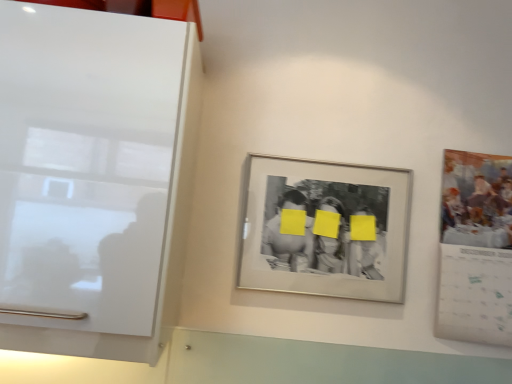
Identify the location of white glossy cabinet at left. (94, 177).

Describe the element at coordinates (94, 177) in the screenshot. The image size is (512, 384). I see `white glossy cabinet at left` at that location.

The height and width of the screenshot is (384, 512). What do you see at coordinates (319, 231) in the screenshot? I see `silver/metallic photo frame at center` at bounding box center [319, 231].

At what (x,y) coordinates should I click in order to perform the action: click on silver/metallic photo frame at center. Please return your answer as a coordinate pair (x, y). Looking at the image, I should click on pos(319,231).

Identify the location of white glossy cabinet at left. The image size is (512, 384). (94, 177).

Is silver/metallic photo frame at center to the left or to the right of white glossy cabinet at left in the image?

In the image, silver/metallic photo frame at center appears on the right side of white glossy cabinet at left.

Does silver/metallic photo frame at center come behind white glossy cabinet at left?

That is True.

Considering the points (268, 224) and (42, 141), which point is in front, point (268, 224) or point (42, 141)?

Positioned in front is point (42, 141).

From the image's perspective, would you say silver/metallic photo frame at center is shown under white glossy cabinet at left?

Indeed, from the image's perspective, silver/metallic photo frame at center is shown beneath white glossy cabinet at left.

From a real-world perspective, between silver/metallic photo frame at center and white glossy cabinet at left, who is vertically higher?

white glossy cabinet at left.

Does silver/metallic photo frame at center have a lesser width compared to white glossy cabinet at left?

Yes, silver/metallic photo frame at center is thinner than white glossy cabinet at left.

Does silver/metallic photo frame at center have a greater height compared to white glossy cabinet at left?

No.

Considering the relative sizes of silver/metallic photo frame at center and white glossy cabinet at left in the image provided, is silver/metallic photo frame at center bigger than white glossy cabinet at left?

No, silver/metallic photo frame at center is not bigger than white glossy cabinet at left.

In the scene shown: Which is correct: silver/metallic photo frame at center is inside white glossy cabinet at left, or outside of it?

silver/metallic photo frame at center is not enclosed by white glossy cabinet at left.

Are silver/metallic photo frame at center and white glossy cabinet at left far apart?

No, silver/metallic photo frame at center is in close proximity to white glossy cabinet at left.

Is silver/metallic photo frame at center positioned with its back to white glossy cabinet at left?

silver/metallic photo frame at center does not have its back to white glossy cabinet at left.

Find the location of a particular element. Image resolution: width=512 pixels, height=384 pixels. picture frame on the right of white glossy cabinet at left is located at coordinates (319, 231).

Does white glossy cabinet at left appear on the left side of silver/metallic photo frame at center?

Correct, you'll find white glossy cabinet at left to the left of silver/metallic photo frame at center.

Is white glossy cabinet at left behind silver/metallic photo frame at center?

That is False.

Which is in front, point (65, 229) or point (306, 288)?

Point (65, 229)

From the image's perspective, is white glossy cabinet at left over silver/metallic photo frame at center?

Yes, from the image's perspective, white glossy cabinet at left is over silver/metallic photo frame at center.

From a real-world perspective, relative to silver/metallic photo frame at center, is white glossy cabinet at left vertically above or below?

white glossy cabinet at left is above silver/metallic photo frame at center.

Which of these two, white glossy cabinet at left or silver/metallic photo frame at center, is thinner?

Thinner between the two is silver/metallic photo frame at center.

Consider the image. Can you confirm if white glossy cabinet at left is taller than silver/metallic photo frame at center?

Yes, white glossy cabinet at left is taller than silver/metallic photo frame at center.

Looking at the image, does white glossy cabinet at left seem bigger or smaller compared to silver/metallic photo frame at center?

Clearly, white glossy cabinet at left is larger in size than silver/metallic photo frame at center.

Is white glossy cabinet at left inside or outside of silver/metallic photo frame at center?

white glossy cabinet at left is spatially situated outside silver/metallic photo frame at center.

Is white glossy cabinet at left in contact with silver/metallic photo frame at center?

No, white glossy cabinet at left is not making contact with silver/metallic photo frame at center.

Is white glossy cabinet at left positioned with its back to silver/metallic photo frame at center?

white glossy cabinet at left does not have its back to silver/metallic photo frame at center.

How many degrees apart are the facing directions of white glossy cabinet at left and silver/metallic photo frame at center?

0.403 degrees.

You are a GUI agent. You are given a task and a screenshot of the screen. Output one action in this format:
    pyautogui.click(x=<x>, y=<y>)
    Task: Click on the glass door in front of the silver/metallic photo frame at center
    This screenshot has width=512, height=384.
    Given the screenshot: What is the action you would take?
    pyautogui.click(x=94, y=177)

Where is `glass door located on the left of silver/metallic photo frame at center`? Image resolution: width=512 pixels, height=384 pixels. glass door located on the left of silver/metallic photo frame at center is located at coordinates (94, 177).

I want to click on glass door in front of the silver/metallic photo frame at center, so click(x=94, y=177).